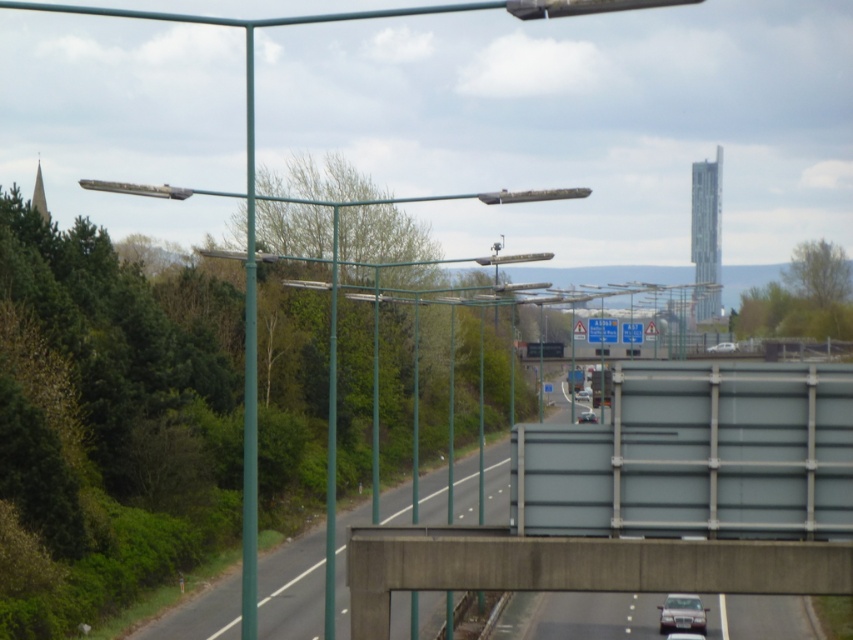
Between white glossy car at center and metallic silver sedan at center, which one is positioned higher?

white glossy car at center is above.

The width and height of the screenshot is (853, 640). What do you see at coordinates (723, 348) in the screenshot?
I see `white glossy car at center` at bounding box center [723, 348].

Does point (711, 349) come farther from viewer compared to point (671, 634)?

Yes, point (711, 349) is behind point (671, 634).

I want to click on white glossy car at center, so click(723, 348).

Is metallic silver sedan at center wider than metallic silver car at center?

No.

Who is positioned more to the right, metallic silver sedan at center or metallic silver car at center?

Positioned to the right is metallic silver sedan at center.

Find the location of a particular element. metallic silver sedan at center is located at coordinates (683, 636).

The height and width of the screenshot is (640, 853). I want to click on metallic silver sedan at center, so click(x=683, y=636).

Who is more forward, (248, 202) or (589, 396)?

Positioned in front is point (248, 202).

This screenshot has width=853, height=640. I want to click on green metallic pole at center, so click(x=248, y=374).